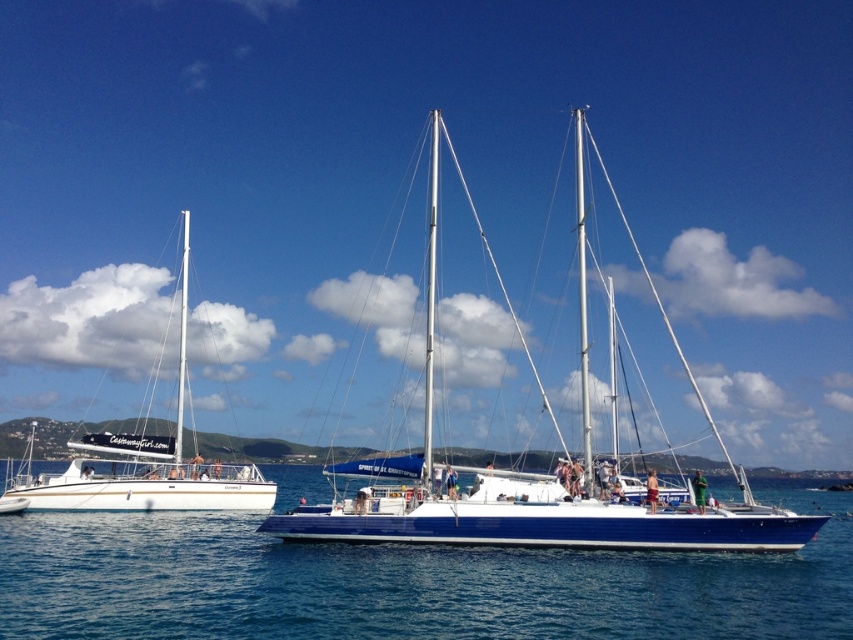
Question: Which is nearer to the white glossy sailboat at left?

Choices:
 (A) blue glossy sailboat at center
 (B) blue water at center

Answer: (B)

Question: Based on their relative distances, which object is nearer to the blue water at center?

Choices:
 (A) white glossy sailboat at left
 (B) blue glossy sailboat at center

Answer: (B)

Question: Can you confirm if blue water at center is smaller than white glossy sailboat at left?

Choices:
 (A) no
 (B) yes

Answer: (B)

Question: Can you confirm if blue glossy sailboat at center is positioned to the right of white glossy sailboat at left?

Choices:
 (A) yes
 (B) no

Answer: (A)

Question: Among these objects, which one is farthest from the camera?

Choices:
 (A) blue glossy sailboat at center
 (B) blue water at center

Answer: (A)

Question: Does blue glossy sailboat at center appear over white glossy sailboat at left?

Choices:
 (A) no
 (B) yes

Answer: (B)